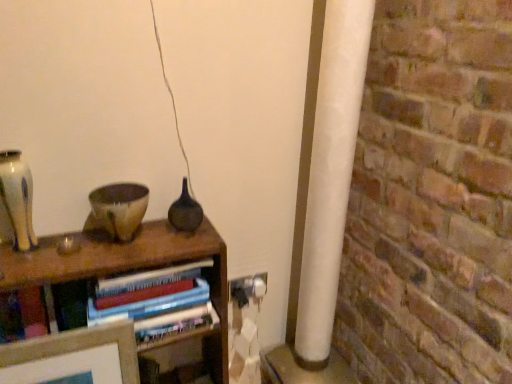
Question: Would you say hardcover books at center is inside or outside speckled ceramic bowl at center?

Choices:
 (A) outside
 (B) inside

Answer: (A)

Question: From the image's perspective, relative to speckled ceramic bowl at center, is hardcover books at center above or below?

Choices:
 (A) above
 (B) below

Answer: (B)

Question: Based on their relative distances, which object is nearer to the speckled ceramic bowl at center?

Choices:
 (A) matte dark glass vase at center, which is the first glass vase from right to left
 (B) white plastic electric outlet at lower right
 (C) matte beige vase at left, the 1th glass vase viewed from the front
 (D) hardcover books at center

Answer: (A)

Question: Considering the real-world distances, which object is farthest from the hardcover books at center?

Choices:
 (A) white plastic electric outlet at lower right
 (B) matte dark glass vase at center, the 2th glass vase viewed from the left
 (C) matte beige vase at left, arranged as the 2th glass vase when viewed from the right
 (D) speckled ceramic bowl at center

Answer: (A)